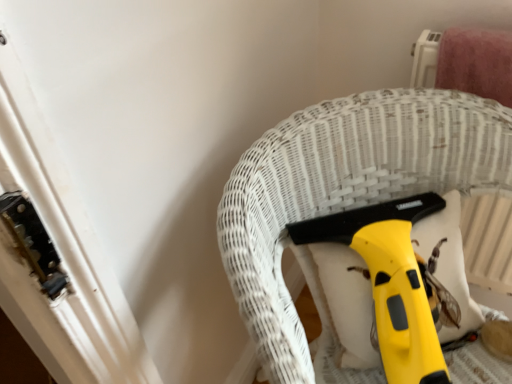
Question: From a real-world perspective, is yellow plastic squeegee at center above or below yellow plastic vacuum cleaner at center?

Choices:
 (A) below
 (B) above

Answer: (B)

Question: In terms of size, does yellow plastic squeegee at center appear bigger or smaller than yellow plastic vacuum cleaner at center?

Choices:
 (A) small
 (B) big

Answer: (A)

Question: In terms of width, does yellow plastic squeegee at center look wider or thinner when compared to yellow plastic vacuum cleaner at center?

Choices:
 (A) thin
 (B) wide

Answer: (A)

Question: From a real-world perspective, is yellow plastic vacuum cleaner at center positioned above or below yellow plastic squeegee at center?

Choices:
 (A) above
 (B) below

Answer: (B)

Question: Visually, is yellow plastic vacuum cleaner at center positioned to the left or to the right of yellow plastic squeegee at center?

Choices:
 (A) left
 (B) right

Answer: (B)

Question: From the image's perspective, is yellow plastic vacuum cleaner at center positioned above or below yellow plastic squeegee at center?

Choices:
 (A) below
 (B) above

Answer: (A)

Question: Considering the positions of yellow plastic vacuum cleaner at center and yellow plastic squeegee at center in the image, is yellow plastic vacuum cleaner at center wider or thinner than yellow plastic squeegee at center?

Choices:
 (A) wide
 (B) thin

Answer: (A)